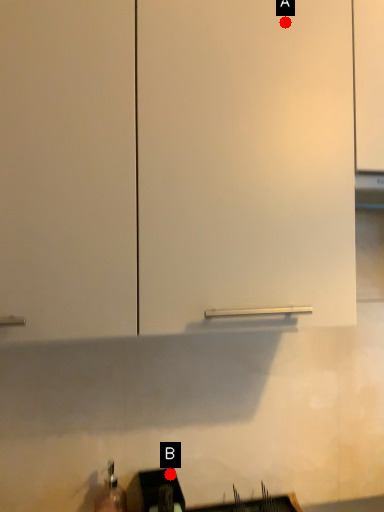
Question: Two points are circled on the image, labeled by A and B beside each circle. Among these points, which one is farthest from the camera?

Choices:
 (A) A is further
 (B) B is further

Answer: (B)